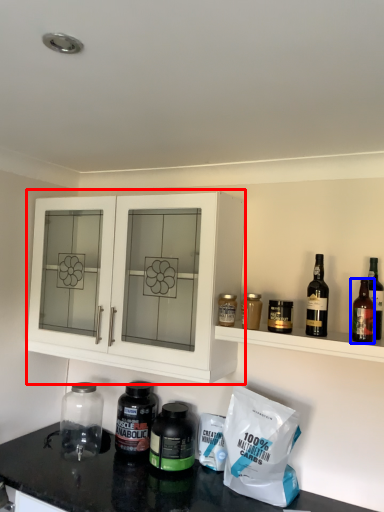
Question: Among these objects, which one is nearest to the camera, cabinetry (highlighted by a red box) or wine bottle (highlighted by a blue box)?

Choices:
 (A) cabinetry
 (B) wine bottle

Answer: (B)